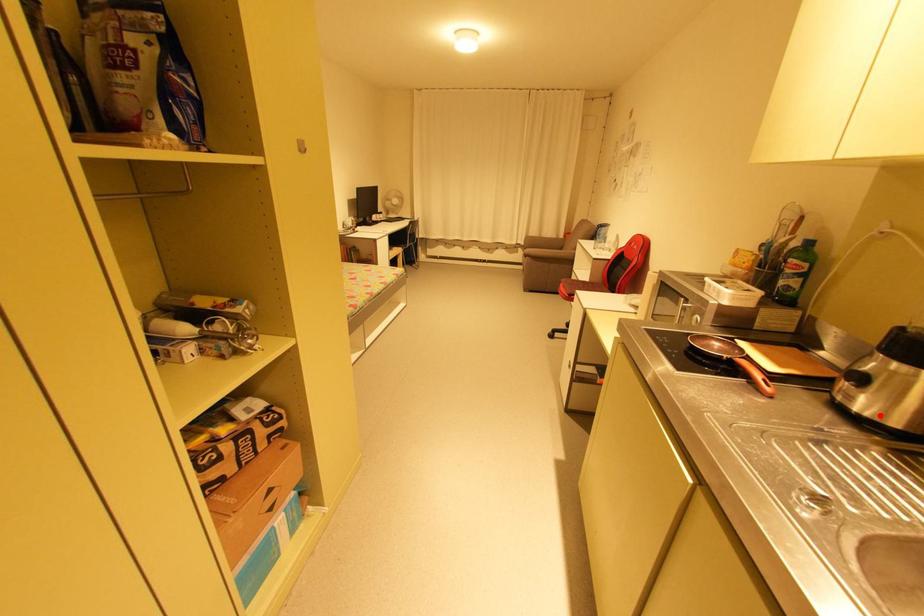
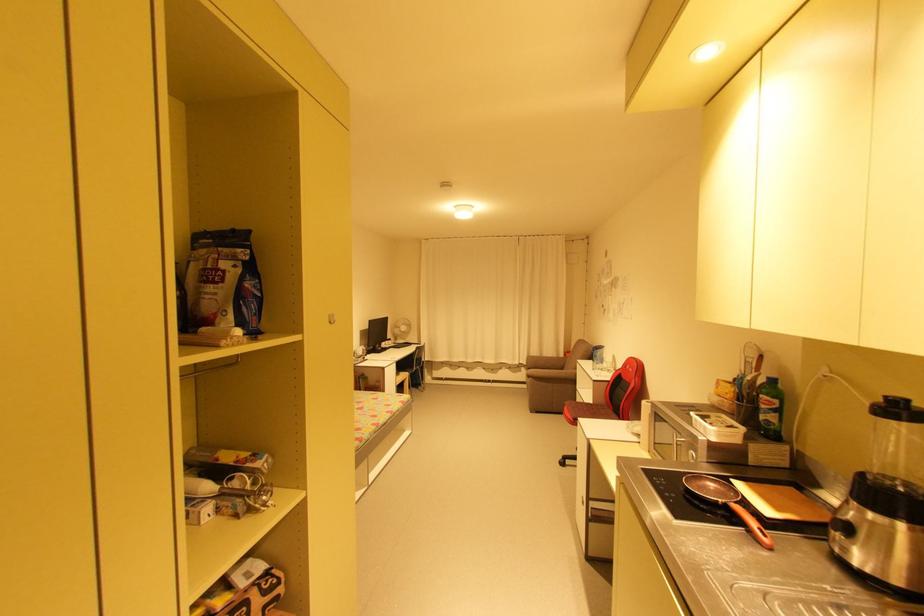
Find the pixel in the second image that matches the highlighted location in the first image.

(878, 570)